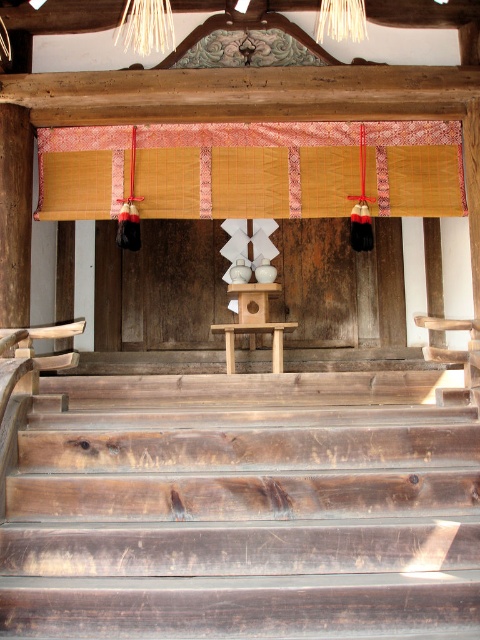
Who is higher up, dark brown wood stairs at center or bamboo mat at upper center?

bamboo mat at upper center

Does dark brown wood stairs at center have a greater width compared to bamboo mat at upper center?

No, dark brown wood stairs at center is not wider than bamboo mat at upper center.

Is point (41, 440) positioned before point (385, 168)?

Yes, point (41, 440) is closer to viewer.

The height and width of the screenshot is (640, 480). Find the location of `dark brown wood stairs at center`. dark brown wood stairs at center is located at coordinates (242, 509).